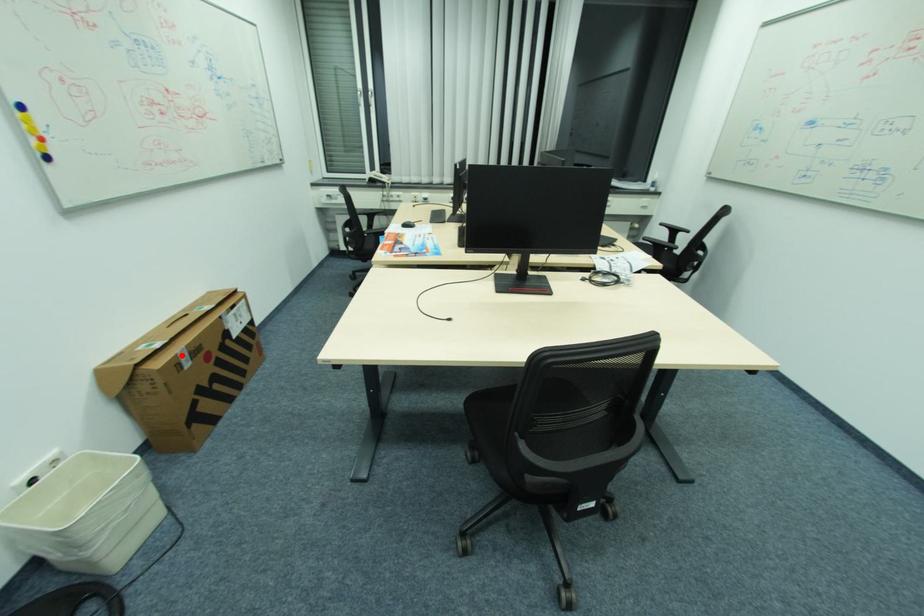
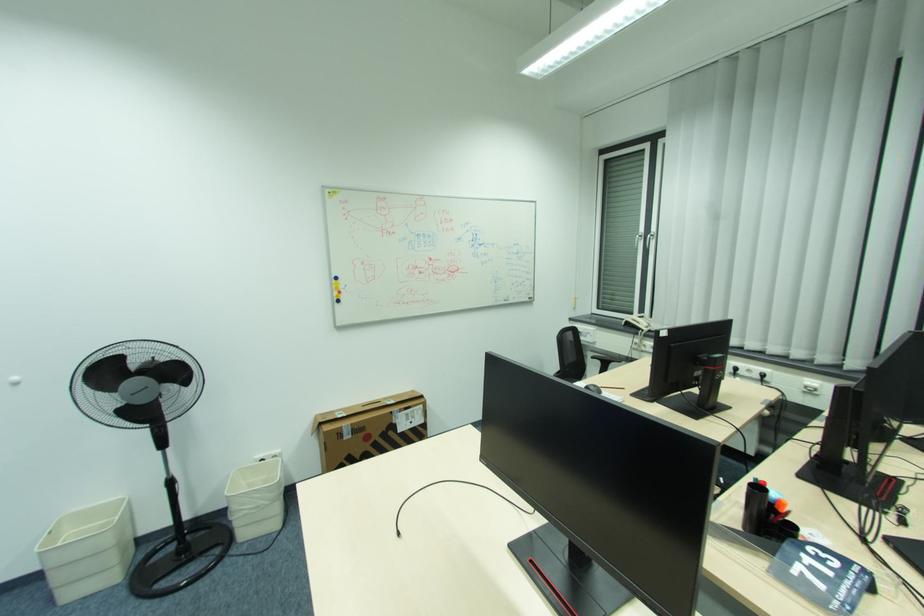
In the second image, find the point that corresponds to the highlighted location in the first image.

(346, 427)